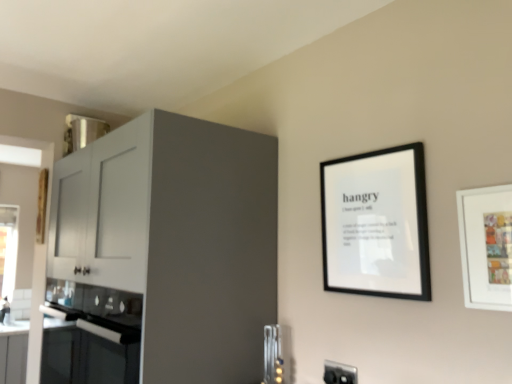
Question: Is black plastic electric outlet at lower right bigger or smaller than white matte picture frame at right, positioned as the 2th picture frame in left-to-right order?

Choices:
 (A) small
 (B) big

Answer: (A)

Question: From the image's perspective, is black plastic electric outlet at lower right above or below white matte picture frame at right, which appears as the first picture frame when viewed from the right?

Choices:
 (A) above
 (B) below

Answer: (B)

Question: Which is nearer to the black plastic electric outlet at lower right?

Choices:
 (A) metallic silver utensils at lower center
 (B) black glass oven at lower left
 (C) white matte picture frame at right, which is the 2th picture frame from back to front
 (D) black matte picture frame at upper right, the second picture frame viewed from the front
 (E) matte white cabinet at left

Answer: (A)

Question: Which is farther from the metallic silver utensils at lower center?

Choices:
 (A) black glass oven at lower left
 (B) black plastic electric outlet at lower right
 (C) black matte picture frame at upper right, marked as the first picture frame in a back-to-front arrangement
 (D) matte white cabinet at left
 (E) white matte picture frame at right, the 1th picture frame viewed from the front

Answer: (E)